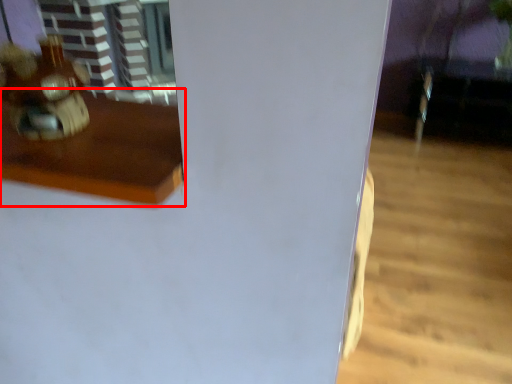
Question: From the image, what is the correct spatial relationship of furniture (annotated by the red box) in relation to toy?

Choices:
 (A) left
 (B) right

Answer: (B)